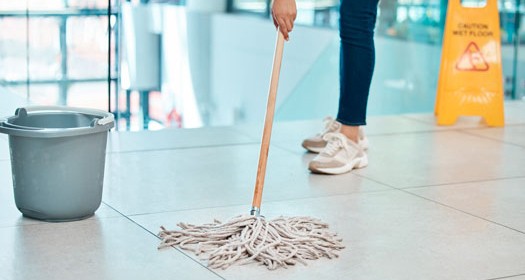
Image resolution: width=525 pixels, height=280 pixels. Identify the location of string mop handle. (257, 190).